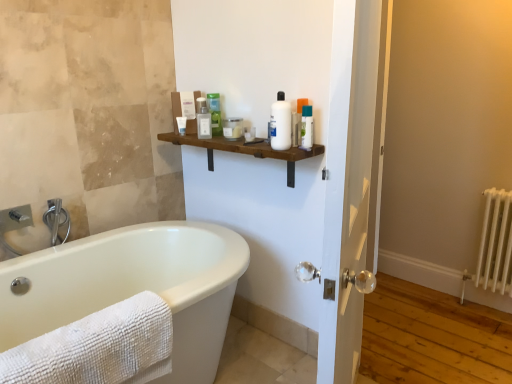
Question: Is brushed metal faucet at left closer to the viewer compared to green matte bottle at upper center, which is the third toiletry from left to right?

Choices:
 (A) no
 (B) yes

Answer: (B)

Question: Considering the relative sizes of brushed metal faucet at left and green matte bottle at upper center, which is the third toiletry from left to right, in the image provided, is brushed metal faucet at left shorter than green matte bottle at upper center, which is the third toiletry from left to right,?

Choices:
 (A) no
 (B) yes

Answer: (B)

Question: From a real-world perspective, is brushed metal faucet at left physically above green matte bottle at upper center, which is the third toiletry from left to right?

Choices:
 (A) no
 (B) yes

Answer: (A)

Question: Is brushed metal faucet at left positioned far away from green matte bottle at upper center, which is the third toiletry from left to right?

Choices:
 (A) no
 (B) yes

Answer: (A)

Question: From a real-world perspective, is brushed metal faucet at left located beneath green matte bottle at upper center, which is the third toiletry from left to right?

Choices:
 (A) yes
 (B) no

Answer: (A)

Question: Looking at the image, does translucent plastic bottle at upper center, which is the 5th toiletry in right-to-left order, seem bigger or smaller compared to brushed metal faucet at left?

Choices:
 (A) small
 (B) big

Answer: (A)

Question: Considering the positions of translucent plastic bottle at upper center, which is the 5th toiletry in right-to-left order, and brushed metal faucet at left in the image, is translucent plastic bottle at upper center, which is the 5th toiletry in right-to-left order, wider or thinner than brushed metal faucet at left?

Choices:
 (A) thin
 (B) wide

Answer: (A)

Question: From a real-world perspective, is translucent plastic bottle at upper center, acting as the 2th toiletry starting from the left, above or below brushed metal faucet at left?

Choices:
 (A) above
 (B) below

Answer: (A)

Question: Choose the correct answer: Is translucent plastic bottle at upper center, which is the 5th toiletry in right-to-left order, inside brushed metal faucet at left or outside it?

Choices:
 (A) inside
 (B) outside

Answer: (B)

Question: In the image, is brushed metal faucet at left on the left side or the right side of wooden shelf at center?

Choices:
 (A) right
 (B) left

Answer: (B)

Question: Is point (53, 206) positioned closer to the camera than point (289, 152)?

Choices:
 (A) farther
 (B) closer

Answer: (A)

Question: Would you say brushed metal faucet at left is inside or outside wooden shelf at center?

Choices:
 (A) inside
 (B) outside

Answer: (B)

Question: From a real-world perspective, is brushed metal faucet at left positioned above or below wooden shelf at center?

Choices:
 (A) below
 (B) above

Answer: (A)

Question: From a real-world perspective, is green matte bottle at upper center, which is the third toiletry from left to right, physically located above or below translucent plastic jar at upper center, acting as the third toiletry starting from the right?

Choices:
 (A) below
 (B) above

Answer: (B)

Question: Looking at the image, does green matte bottle at upper center, the fourth toiletry in the right-to-left sequence, seem bigger or smaller compared to translucent plastic jar at upper center, placed as the fourth toiletry when sorted from left to right?

Choices:
 (A) small
 (B) big

Answer: (A)